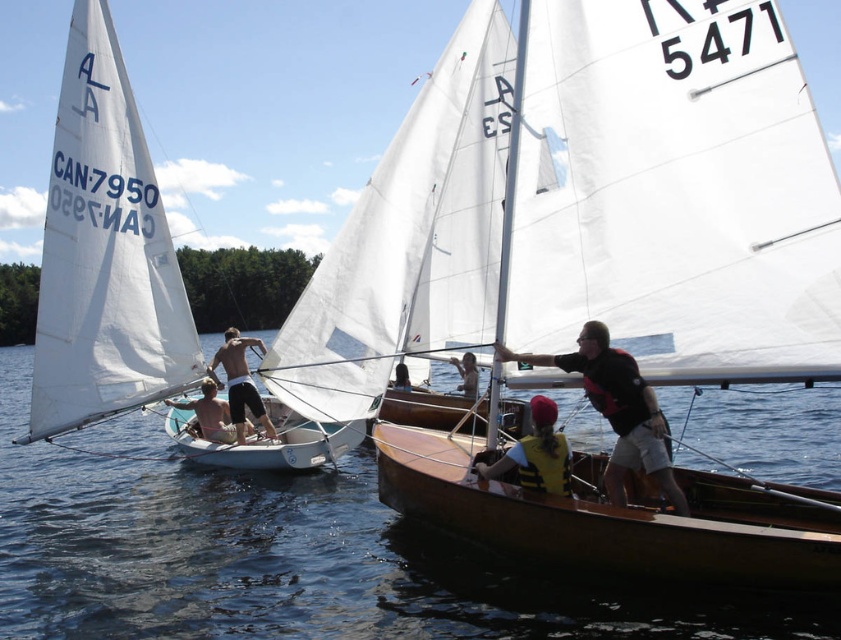
Looking at this image, you are a spectator watching the sailboat race. You see the brown wood boat at center and the light brown wooden boat at center. Which boat is closer to you?

The brown wood boat at center is closer to you because it is in front of the light brown wooden boat at center.

You are a safety inspector reviewing the image of the sailboat race. You notice the yellow life vest at center and the tan skin man at center. According to safety regulations, every participant must have a life vest within easy reach. Does the current arrangement comply with the safety rule?

The yellow life vest at center is in front of the tan skin man at center, which means it is positioned in a reachable location. Therefore, the arrangement complies with the safety regulation requiring life vests to be within easy reach.